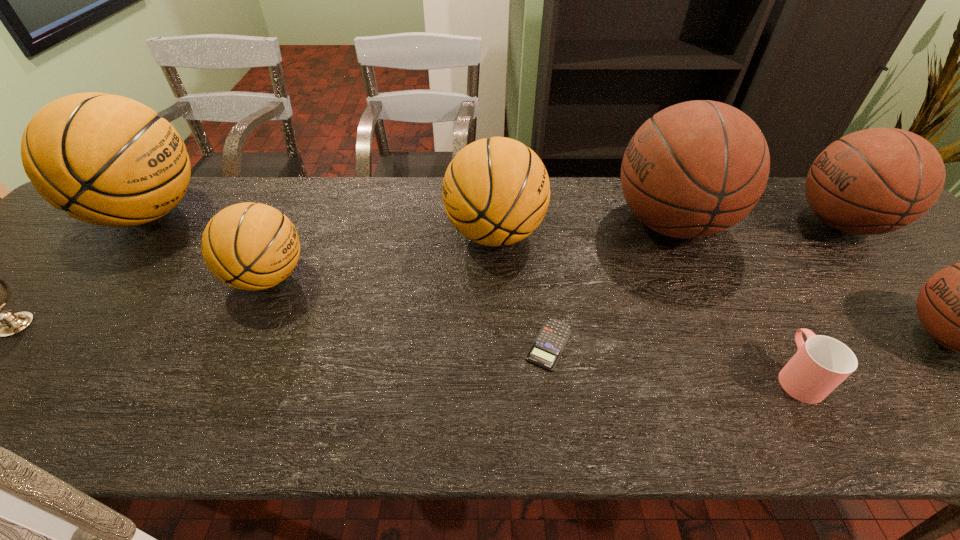
I want to click on free spot located 0.340m on the side with brand label of the second biggest brown basketball, so click(x=668, y=223).

You are a GUI agent. You are given a task and a screenshot of the screen. Output one action in this format:
    pyautogui.click(x=<x>, y=<y>)
    Task: Click on the vacant space located on the side with brand label of the second biggest brown basketball
    
    Given the screenshot: What is the action you would take?
    pyautogui.click(x=741, y=223)

Identify the location of vacant space located on the surface of the third object from left to right near the brand logo. (449, 277).

The image size is (960, 540). What are the coordinates of `vacant space located 0.360m on the side of the eighth tallest object with the handle` in the screenshot? It's located at (718, 237).

The image size is (960, 540). In order to click on vacant space located 0.290m on the side of the eighth tallest object with the handle in this screenshot , I will do `click(728, 255)`.

The image size is (960, 540). Find the location of `free space located 0.270m on the side of the eighth tallest object with the handle`. free space located 0.270m on the side of the eighth tallest object with the handle is located at coordinates (732, 261).

Locate an element on the screen. free location located 0.200m on the right of the calculator is located at coordinates (670, 344).

Find the location of a particular element. object that is at the near edge is located at coordinates (820, 364).

Locate an element on the screen. object located at the left edge is located at coordinates (108, 160).

Find the location of a particular element. object that is at the right edge is located at coordinates (878, 180).